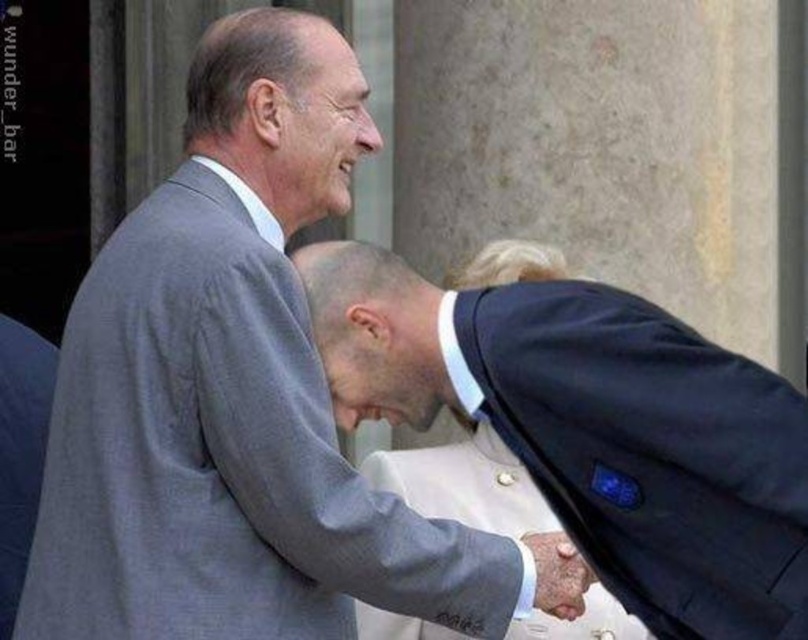
Is dark blue suit at center wider than smooth leather hand at center?

No, dark blue suit at center is not wider than smooth leather hand at center.

Between point (541, 292) and point (577, 557), which one is positioned behind?

Point (577, 557)

The height and width of the screenshot is (640, 808). What are the coordinates of `dark blue suit at center` in the screenshot? It's located at (595, 428).

Is gray suit at center thinner than smooth leather hand at center?

Yes.

Does gray suit at center have a larger size compared to smooth leather hand at center?

No.

Identify the location of gray suit at center. Image resolution: width=808 pixels, height=640 pixels. (234, 394).

Between point (400, 506) and point (672, 355), which one is positioned in front?

Point (672, 355)

Where is `gray suit at center`? gray suit at center is located at coordinates (234, 394).